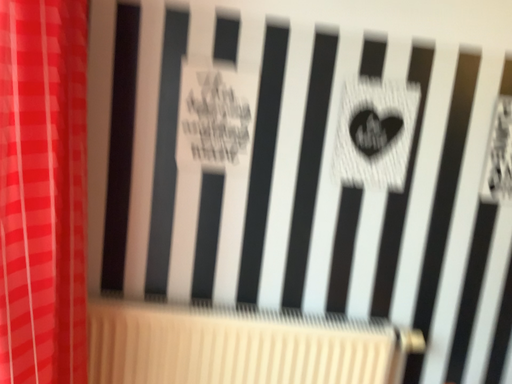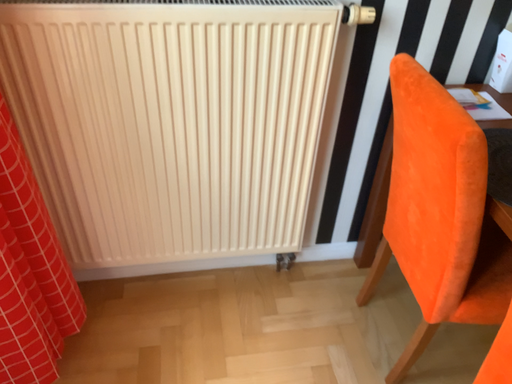
Question: Which way did the camera rotate in the video?

Choices:
 (A) rotated downward
 (B) rotated upward

Answer: (A)